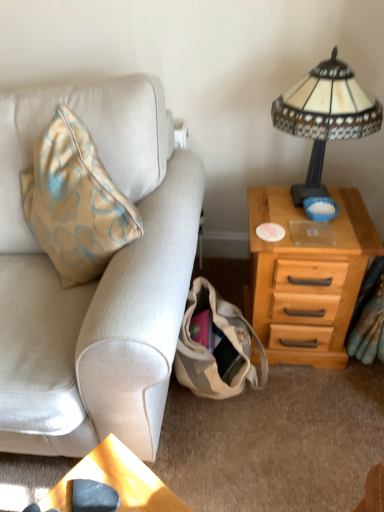
Question: Considering the positions of beige canvas bag at lower center and wooden nightstand at right in the image, is beige canvas bag at lower center wider or thinner than wooden nightstand at right?

Choices:
 (A) wide
 (B) thin

Answer: (B)

Question: From a real-world perspective, is beige canvas bag at lower center above or below wooden nightstand at right?

Choices:
 (A) below
 (B) above

Answer: (A)

Question: Based on their relative distances, which object is nearer to the beige fabric couch at left?

Choices:
 (A) beige canvas bag at lower center
 (B) stained glass lampshade at upper right
 (C) wooden nightstand at right

Answer: (A)

Question: Based on their relative distances, which object is farther from the wooden nightstand at right?

Choices:
 (A) beige fabric couch at left
 (B) stained glass lampshade at upper right
 (C) beige canvas bag at lower center

Answer: (A)